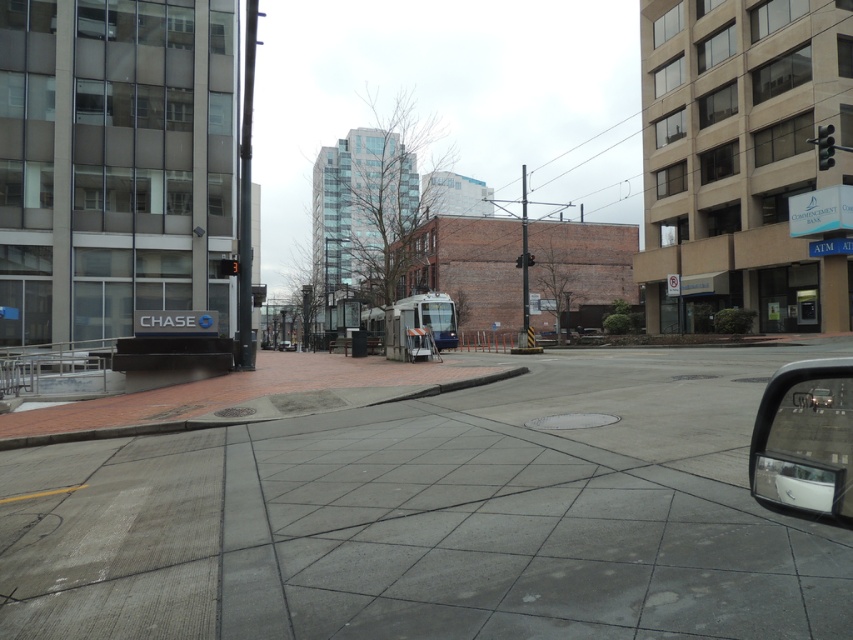
You are a pedestrian standing on the sidewalk next to the Chase bank. You want to cross the street to reach the park on the other side. The park is located beyond the road where the metallic gray car at lower right is parked. To your left, there is a crosswalk. However, you notice the metallic traffic light at upper right. Which direction should you look to see the traffic light before crossing?

The metallic traffic light at upper right is to the right of the metallic gray car at lower right. Therefore, you should look to your right to see the traffic light before crossing the street.